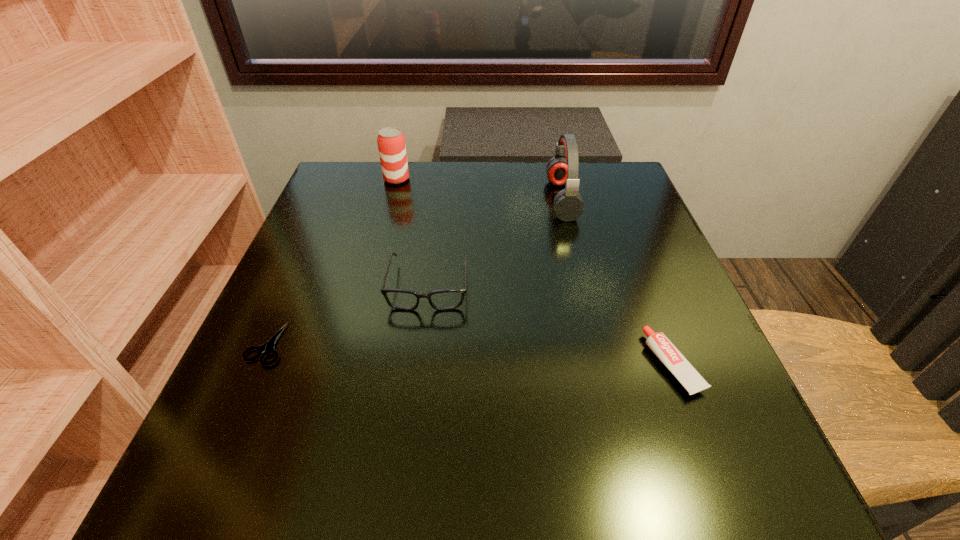
Find the location of a particular element. unoccupied area between the fourth tallest object and the third shortest object is located at coordinates (551, 325).

Point out which object is positioned as the fourth nearest to the shears. Please provide its 2D coordinates. Your answer should be formatted as a tuple, i.e. [(x, y)], where the tuple contains the x and y coordinates of a point satisfying the conditions above.

[(669, 355)]

Locate which object ranks second in proximity to the shortest object. Please provide its 2D coordinates. Your answer should be formatted as a tuple, i.e. [(x, y)], where the tuple contains the x and y coordinates of a point satisfying the conditions above.

[(391, 141)]

Image resolution: width=960 pixels, height=540 pixels. I want to click on free point that satisfies the following two spatial constraints: 1. on the ear cups of the toothpaste; 2. on the left side of the tallest object, so click(x=602, y=364).

This screenshot has width=960, height=540. In order to click on blank area in the image that satisfies the following two spatial constraints: 1. on the ear cups of the second object from right to left; 2. on the right side of the second shortest object in this screenshot , I will do `click(602, 364)`.

Where is `vacant position in the image that satisfies the following two spatial constraints: 1. on the front side of the beer can; 2. on the right side of the rightmost object`? The image size is (960, 540). vacant position in the image that satisfies the following two spatial constraints: 1. on the front side of the beer can; 2. on the right side of the rightmost object is located at coordinates (348, 364).

Find the location of `free space that satisfies the following two spatial constraints: 1. on the ear cups of the earphone; 2. on the right side of the rightmost object`. free space that satisfies the following two spatial constraints: 1. on the ear cups of the earphone; 2. on the right side of the rightmost object is located at coordinates (602, 364).